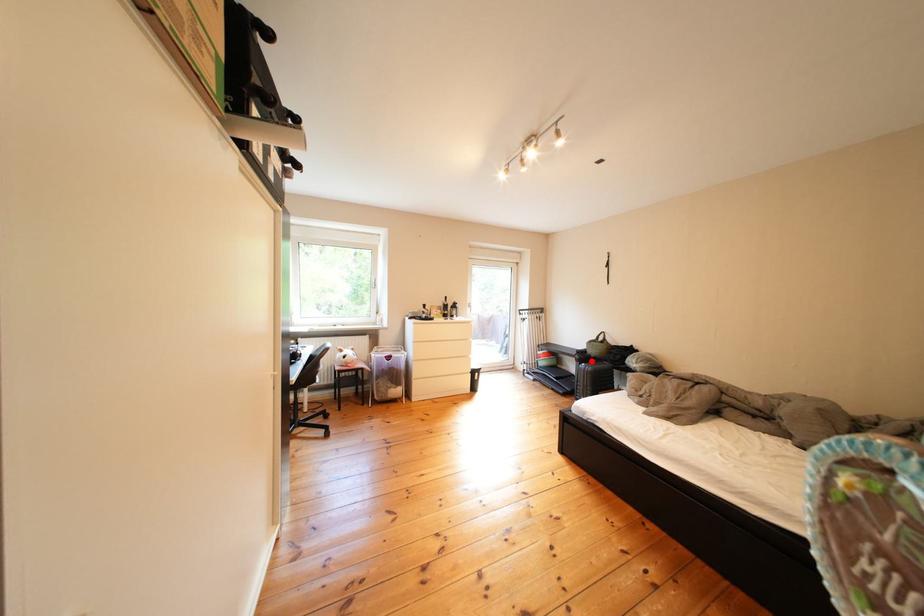
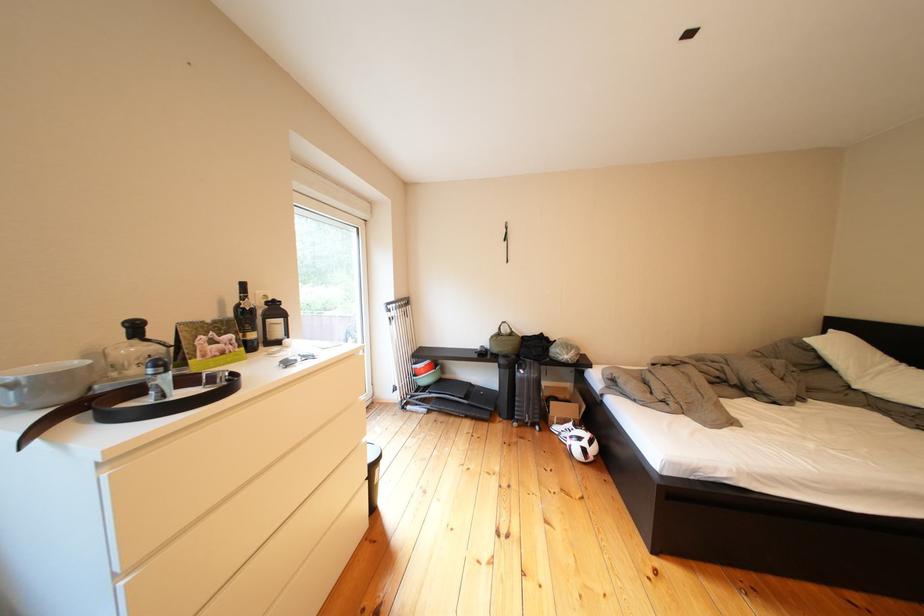
Question: I am providing you with two images of the same scene from different viewpoints. Given a red point in image1, look at the same physical point in image2. Is it:

Choices:
 (A) Closer to the viewpoint
 (B) Farther from the viewpoint

Answer: (B)